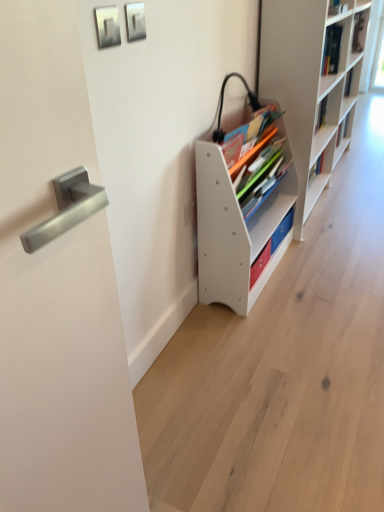
Question: Is white plastic shelf at center, marked as the 2th shelf in a right-to-left arrangement, inside or outside of white matte bookshelf at right, the 2th shelf viewed from the left?

Choices:
 (A) inside
 (B) outside

Answer: (B)

Question: From their relative heights in the image, would you say white plastic shelf at center, marked as the 2th shelf in a right-to-left arrangement, is taller or shorter than white matte bookshelf at right, the 2th shelf viewed from the left?

Choices:
 (A) short
 (B) tall

Answer: (A)

Question: Estimate the real-world distances between objects in this image. Which object is farther from the metallic silver picture frame at upper center, placed as the 2th picture frame when sorted from left to right?

Choices:
 (A) white plastic shelf at center, the 1th shelf viewed from the left
 (B) white matte bookshelf at right, the 2th shelf viewed from the left
 (C) metallic silver picture frame at upper center, acting as the first picture frame starting from the left
 (D) satin silver handle at left
 (E) matte white bookshelf at center

Answer: (B)

Question: Based on their relative distances, which object is farther from the metallic silver picture frame at upper center, which is the second picture frame from right to left?

Choices:
 (A) metallic silver picture frame at upper center, which is counted as the 1th picture frame, starting from the right
 (B) white matte bookshelf at right, placed as the 1th shelf when sorted from right to left
 (C) white plastic shelf at center, the 1th shelf viewed from the left
 (D) satin silver handle at left
 (E) matte white bookshelf at center

Answer: (B)